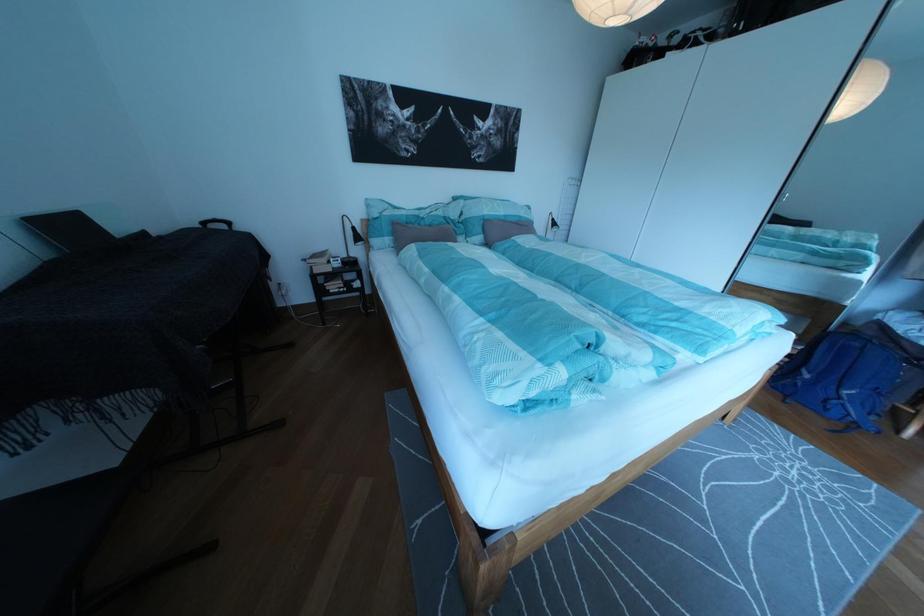
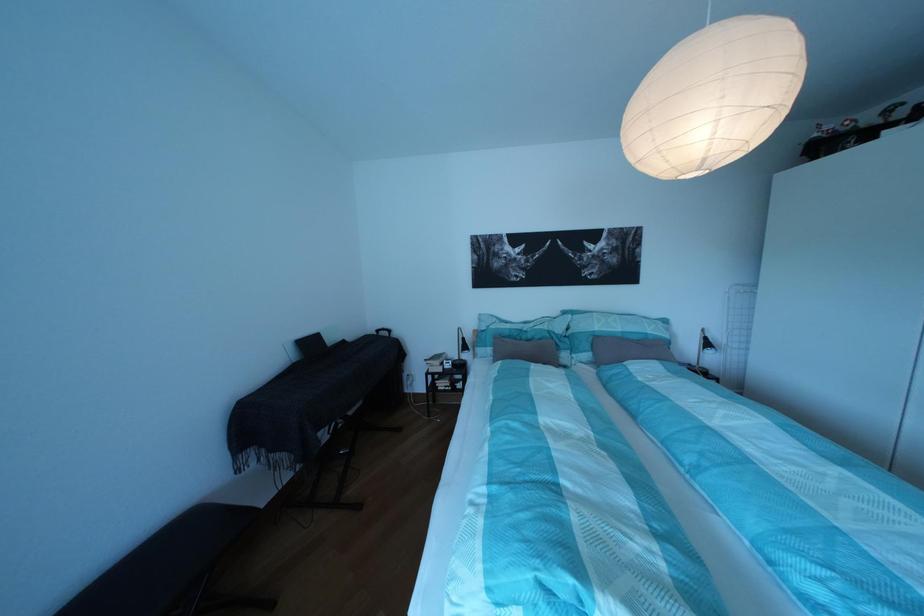
The point at (516,225) is marked in the first image. Where is the corresponding point in the second image?

(633, 341)